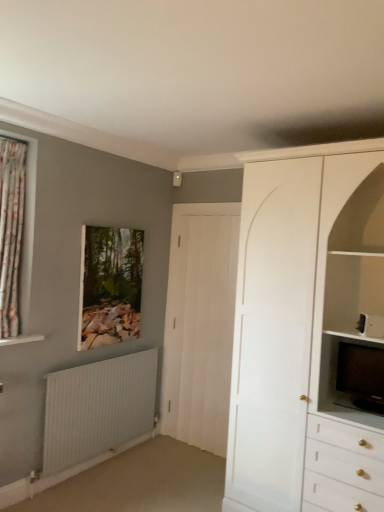
Question: Is white ribbed radiator at lower left positioned with its back to white matte cabinet at upper right?

Choices:
 (A) yes
 (B) no

Answer: (B)

Question: From a real-world perspective, is white ribbed radiator at lower left positioned under white matte cabinet at upper right based on gravity?

Choices:
 (A) yes
 (B) no

Answer: (A)

Question: Does white ribbed radiator at lower left have a lesser height compared to white matte cabinet at upper right?

Choices:
 (A) yes
 (B) no

Answer: (A)

Question: Is white ribbed radiator at lower left with white matte cabinet at upper right?

Choices:
 (A) yes
 (B) no

Answer: (B)

Question: From the image's perspective, is white ribbed radiator at lower left below white matte cabinet at upper right?

Choices:
 (A) no
 (B) yes

Answer: (B)

Question: In the image, is white wood door at center on the left side or the right side of wooden frame at upper center?

Choices:
 (A) left
 (B) right

Answer: (B)

Question: Is white wood door at center situated inside wooden frame at upper center or outside?

Choices:
 (A) outside
 (B) inside

Answer: (A)

Question: Relative to wooden frame at upper center, is white wood door at center in front or behind?

Choices:
 (A) front
 (B) behind

Answer: (B)

Question: From the image's perspective, relative to wooden frame at upper center, is white wood door at center above or below?

Choices:
 (A) above
 (B) below

Answer: (B)

Question: Would you say white wood door at center is to the left or to the right of black glossy television at right in the picture?

Choices:
 (A) left
 (B) right

Answer: (A)

Question: Considering their positions, is white wood door at center located in front of or behind black glossy television at right?

Choices:
 (A) front
 (B) behind

Answer: (B)

Question: In terms of height, does white wood door at center look taller or shorter compared to black glossy television at right?

Choices:
 (A) tall
 (B) short

Answer: (A)

Question: From the image's perspective, is white wood door at center positioned above or below black glossy television at right?

Choices:
 (A) above
 (B) below

Answer: (A)

Question: Is floral fabric curtain at left spatially inside white wood door at center, or outside of it?

Choices:
 (A) outside
 (B) inside

Answer: (A)

Question: In terms of height, does floral fabric curtain at left look taller or shorter compared to white wood door at center?

Choices:
 (A) short
 (B) tall

Answer: (A)